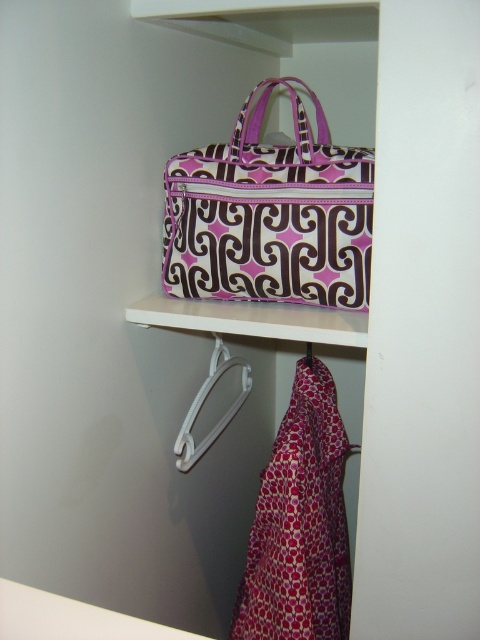
You are organizing a closet and need to place a new item on the shelf. The shelf has a coordinate system where the bottom left corner is the origin. The point at coordinates point [269,214] is marked. What object is located at this point?

The point at coordinates [269,214] corresponds to the purple fabric bag at upper center.

You are organizing items in a storage space and need to place a new item between the purple fabric bag at upper center and the white plastic hanger at lower center. Based on their positions, where should the new item be placed to ensure it is between them?

The new item should be placed between the purple fabric bag at upper center and the white plastic hanger at lower center, closer to the purple fabric bag at upper center since it is nearer to the viewer than the white plastic hanger at lower center.

You are organizing a closet and need to know if the purple fabric bag at upper center can fit horizontally on the white plastic hanger at lower center. Can it fit?

The purple fabric bag at upper center is wider than the white plastic hanger at lower center, so it cannot fit horizontally on the hanger.